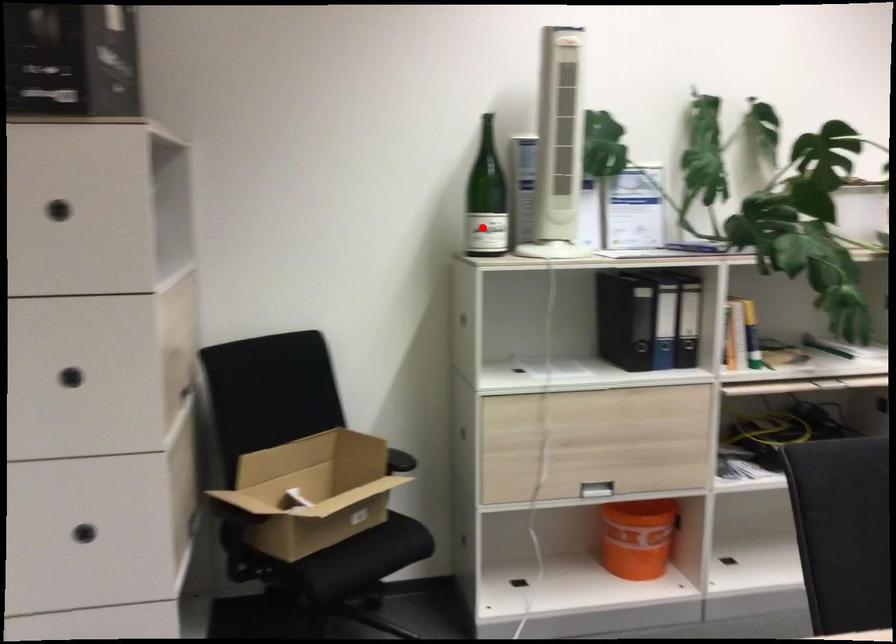
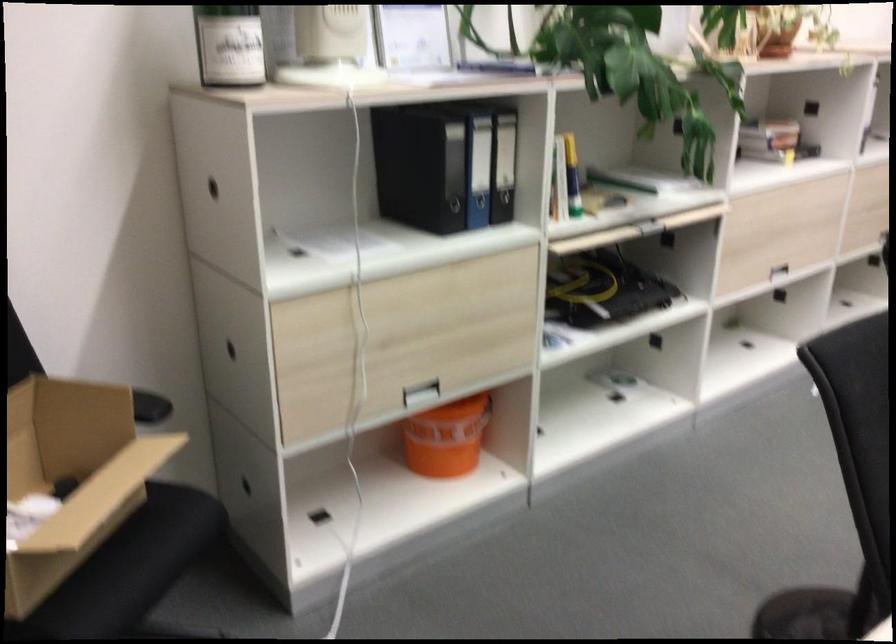
Where in the second image is the point corresponding to the highlighted location from the first image?

(229, 44)